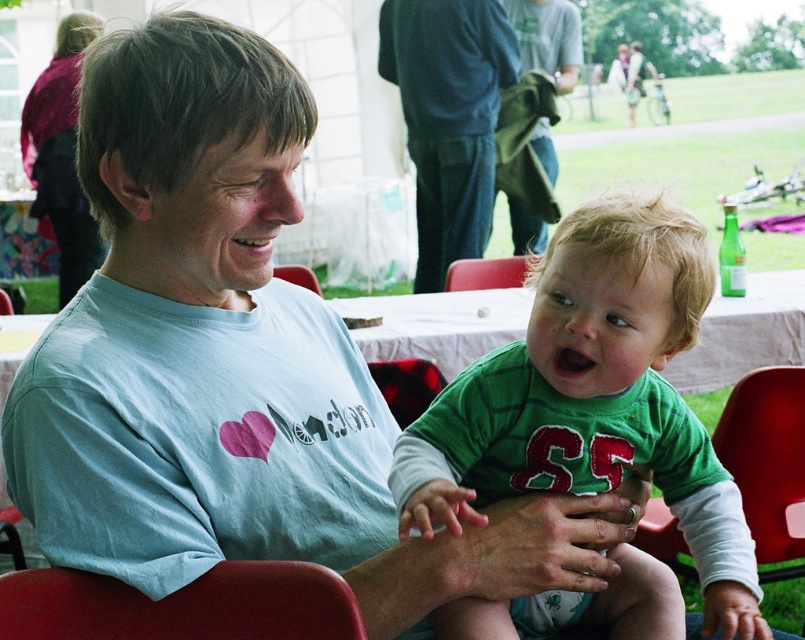
You are organizing a charity clothing drive and need to categorize clothes by size. You have two items to sort out of sight from others in the image. The maroon fabric jacket at upper left and the green cotton shirt at upper center. Which item should you place in the large size bin?

The maroon fabric jacket at upper left should be placed in the large size bin because it is bigger than the green cotton shirt at upper center.